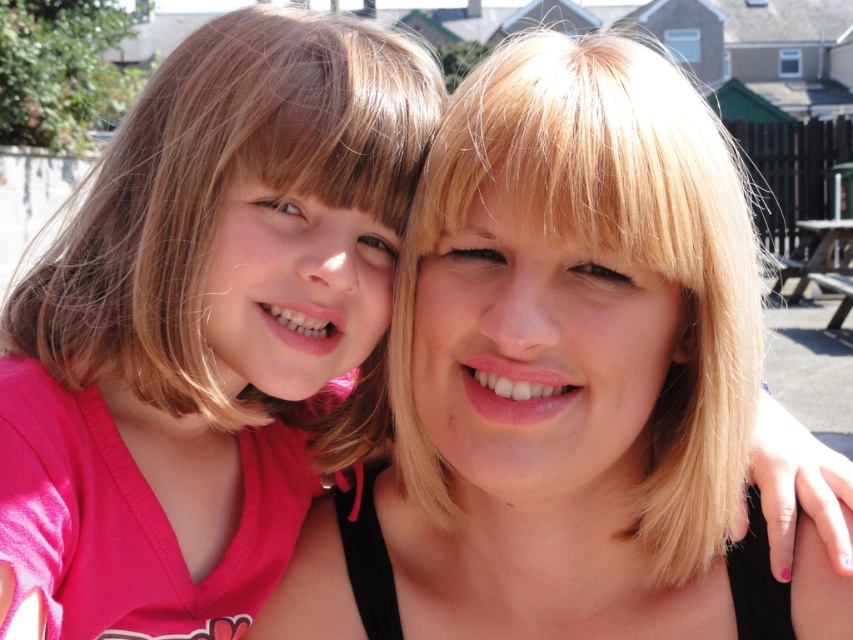
Based on the scene description, which object is positioned higher between the blonde hair at center and the matte pink shirt at left?

The blonde hair at center is taller than the matte pink shirt at left, so the blonde hair at center is positioned higher.

What is located at the coordinates point (x=566, y=380)?

Blonde hair at center is located at point (x=566, y=380).